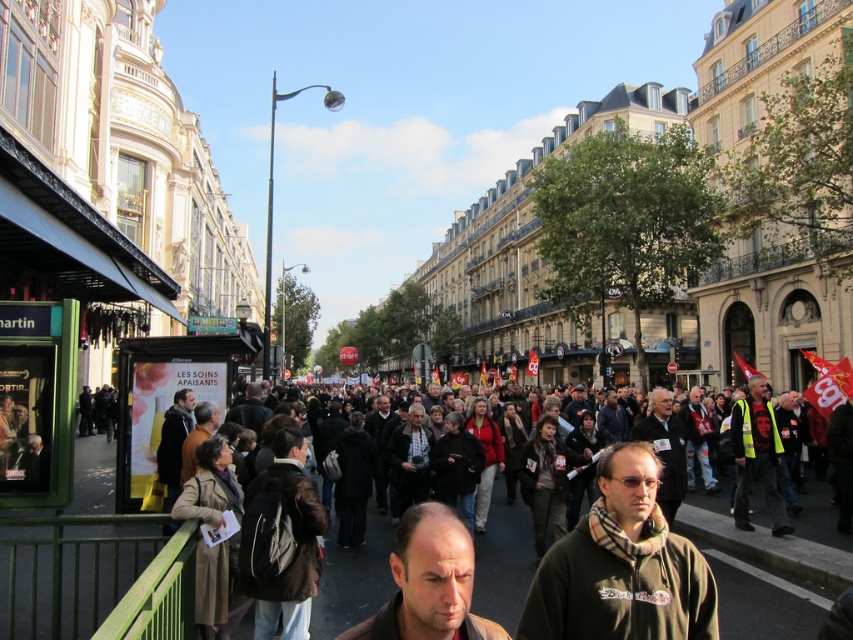
Is dark brown leather jacket at center to the left of brown leather jacket at center from the viewer's perspective?

In fact, dark brown leather jacket at center is to the right of brown leather jacket at center.

Which is behind, point (480, 538) or point (416, 522)?

The point (480, 538) is more distant.

Find the location of `dark brown leather jacket at center`. dark brown leather jacket at center is located at coordinates (352, 577).

Identify the location of dark brown leather jacket at center. Image resolution: width=853 pixels, height=640 pixels. (352, 577).

Between dark green hoodie at center and brown leather jacket at center, which one has more height?

Standing taller between the two is brown leather jacket at center.

What do you see at coordinates (622, 566) in the screenshot? I see `dark green hoodie at center` at bounding box center [622, 566].

Locate an element on the screen. dark green hoodie at center is located at coordinates (622, 566).

Does dark green hoodie at center have a larger size compared to dark brown leather jacket at center?

No, dark green hoodie at center is not bigger than dark brown leather jacket at center.

Does dark green hoodie at center lie in front of dark brown leather jacket at center?

Yes, dark green hoodie at center is closer to the viewer.

Where is `dark green hoodie at center`? This screenshot has height=640, width=853. dark green hoodie at center is located at coordinates (622, 566).